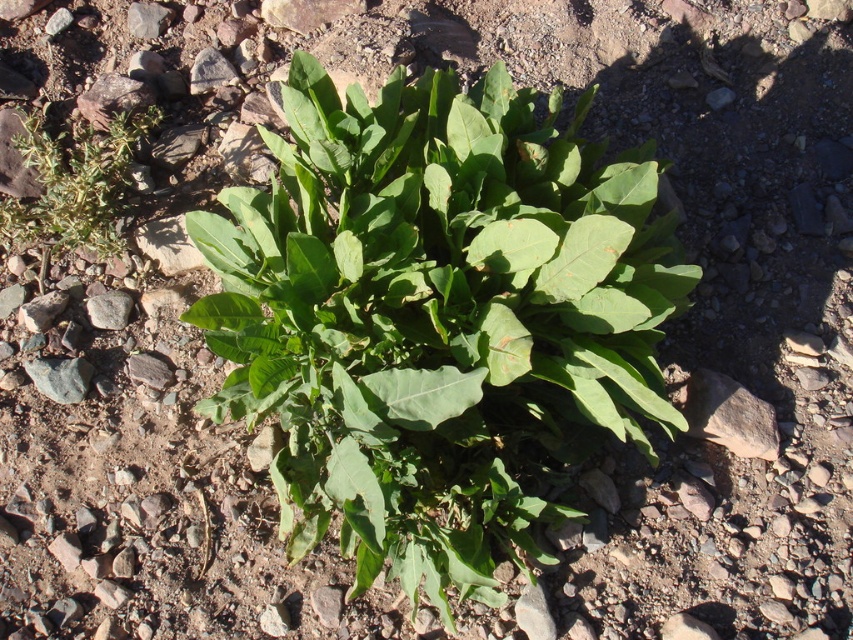
Question: Is green leafy plant at center bigger than green leafy plant at left?

Choices:
 (A) no
 (B) yes

Answer: (B)

Question: Among these points, which one is farthest from the camera?

Choices:
 (A) (489, 292)
 (B) (26, 225)

Answer: (B)

Question: Can you confirm if green leafy plant at center is positioned above green leafy plant at left?

Choices:
 (A) no
 (B) yes

Answer: (A)

Question: Which point is closer to the camera?

Choices:
 (A) (485, 216)
 (B) (44, 246)

Answer: (A)

Question: Is green leafy plant at center to the right of green leafy plant at left from the viewer's perspective?

Choices:
 (A) no
 (B) yes

Answer: (B)